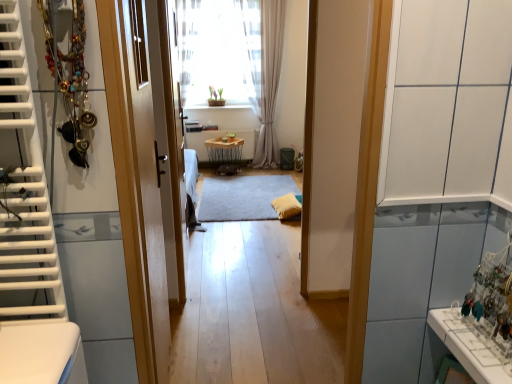
You are a GUI agent. You are given a task and a screenshot of the screen. Output one action in this format:
    pyautogui.click(x=<x>, y=<y>)
    Task: Click on the white sheer curtain at upper center, which ranks as the 1th curtain in left-to-right order
    Image resolution: width=512 pixels, height=384 pixels.
    Given the screenshot: What is the action you would take?
    pyautogui.click(x=187, y=44)

Measure the distance between transparent plastic screen door at center and camera.

transparent plastic screen door at center is 2.34 meters away from camera.

What is the approximate width of white glossy radiator at center?

white glossy radiator at center is 3.10 inches in width.

The width and height of the screenshot is (512, 384). Describe the element at coordinates (218, 137) in the screenshot. I see `white glossy radiator at center` at that location.

What do you see at coordinates (243, 197) in the screenshot?
I see `gray soft rug at center` at bounding box center [243, 197].

This screenshot has width=512, height=384. What are the coordinates of `shiny metallic necklace at left` in the screenshot? It's located at (x=70, y=77).

Where is `light beige sheer curtain at center, the 1th curtain viewed from the right`? light beige sheer curtain at center, the 1th curtain viewed from the right is located at coordinates (269, 80).

Is transparent plastic screen door at center situated inside shiny metallic necklace at left or outside?

transparent plastic screen door at center cannot be found inside shiny metallic necklace at left.

From a real-world perspective, is transparent plastic screen door at center physically located above or below shiny metallic necklace at left?

From a real-world perspective, transparent plastic screen door at center is physically below shiny metallic necklace at left.

Which of these two, transparent plastic screen door at center or shiny metallic necklace at left, is smaller?

Smaller between the two is shiny metallic necklace at left.

Based on the photo, is white sheer curtain at upper center, which ranks as the 1th curtain in left-to-right order, taller than white glossy radiator at center?

Indeed, white sheer curtain at upper center, which ranks as the 1th curtain in left-to-right order, has a greater height compared to white glossy radiator at center.

Which is behind, point (188, 32) or point (222, 132)?

The point (188, 32) is behind.

From the picture: Is white sheer curtain at upper center, which ranks as the 1th curtain in left-to-right order, wider than white glossy radiator at center?

Indeed, white sheer curtain at upper center, which ranks as the 1th curtain in left-to-right order, has a greater width compared to white glossy radiator at center.

Visually, is white sheer curtain at upper center, which ranks as the 1th curtain in left-to-right order, positioned to the left or to the right of white glossy radiator at center?

white sheer curtain at upper center, which ranks as the 1th curtain in left-to-right order, is positioned on white glossy radiator at center's left side.

From the image's perspective, who appears lower, shiny metallic necklace at left or white sheer curtain at upper center, which ranks as the 1th curtain in left-to-right order?

From the image's view, shiny metallic necklace at left is below.

Does shiny metallic necklace at left appear on the right side of white sheer curtain at upper center, which ranks as the 2th curtain in right-to-left order?

Indeed, shiny metallic necklace at left is positioned on the right side of white sheer curtain at upper center, which ranks as the 2th curtain in right-to-left order.

Is shiny metallic necklace at left inside or outside of white sheer curtain at upper center, which ranks as the 1th curtain in left-to-right order?

shiny metallic necklace at left is located beyond the bounds of white sheer curtain at upper center, which ranks as the 1th curtain in left-to-right order.

Between point (211, 147) and point (267, 114), which one is positioned behind?

Point (211, 147)

Can you confirm if wooden table at center is positioned to the right of light beige sheer curtain at center, the second curtain from the left?

No.

Is wooden table at center not inside light beige sheer curtain at center, the second curtain from the left?

wooden table at center lies outside light beige sheer curtain at center, the second curtain from the left,'s area.

Could you measure the distance between wooden table at center and light beige sheer curtain at center, the second curtain from the left?

A distance of 28.29 inches exists between wooden table at center and light beige sheer curtain at center, the second curtain from the left.

From the image's perspective, is white sheer curtain at upper center, which ranks as the 1th curtain in left-to-right order, on transparent plastic screen door at center?

Yes.

From the picture: Between white sheer curtain at upper center, which ranks as the 1th curtain in left-to-right order, and transparent plastic screen door at center, which one is positioned behind?

white sheer curtain at upper center, which ranks as the 1th curtain in left-to-right order, is further away from the camera.

Does white sheer curtain at upper center, which ranks as the 2th curtain in right-to-left order, have a lesser height compared to transparent plastic screen door at center?

Correct, white sheer curtain at upper center, which ranks as the 2th curtain in right-to-left order, is not as tall as transparent plastic screen door at center.

From the image's perspective, is light beige sheer curtain at center, the second curtain from the left, located above or below white glossy radiator at center?

light beige sheer curtain at center, the second curtain from the left, is above white glossy radiator at center.

Between light beige sheer curtain at center, the 1th curtain viewed from the right, and white glossy radiator at center, which one is positioned in front?

light beige sheer curtain at center, the 1th curtain viewed from the right, is more forward.

Does point (279, 27) come in front of point (209, 136)?

That is True.

Is light beige sheer curtain at center, the 1th curtain viewed from the right, oriented towards white glossy radiator at center?

No, light beige sheer curtain at center, the 1th curtain viewed from the right, is not turned towards white glossy radiator at center.

Image resolution: width=512 pixels, height=384 pixels. Identify the location of curtain below the white sheer curtain at upper center, which ranks as the 1th curtain in left-to-right order (from a real-world perspective). (269, 80).

How different are the orientations of white sheer curtain at upper center, which ranks as the 1th curtain in left-to-right order, and light beige sheer curtain at center, the second curtain from the left, in degrees?

0.000129 degrees.

Considering the relative sizes of white sheer curtain at upper center, which ranks as the 1th curtain in left-to-right order, and light beige sheer curtain at center, the second curtain from the left, in the image provided, is white sheer curtain at upper center, which ranks as the 1th curtain in left-to-right order, smaller than light beige sheer curtain at center, the second curtain from the left,?

Indeed, white sheer curtain at upper center, which ranks as the 1th curtain in left-to-right order, has a smaller size compared to light beige sheer curtain at center, the second curtain from the left.

Does point (194, 51) come in front of point (260, 93)?

No, it is not.

This screenshot has height=384, width=512. I want to click on necklace on the right of transparent plastic screen door at center, so click(70, 77).

Find the location of a particular element. The image size is (512, 384). the 2nd curtain positioned above the white glossy radiator at center (from a real-world perspective) is located at coordinates (187, 44).

Considering their positions, is white glossy radiator at center positioned closer to wooden table at center than transparent plastic screen door at center?

→ white glossy radiator at center lies closer to wooden table at center than the other object.

When comparing their distances from wooden door at center, does white sheer curtain at upper center, which ranks as the 1th curtain in left-to-right order, or wooden table at center seem further?

white sheer curtain at upper center, which ranks as the 1th curtain in left-to-right order, lies further to wooden door at center than the other object.

Considering their positions, is wooden table at center positioned further to shiny metallic necklace at left than white glossy radiator at center?

The object further to shiny metallic necklace at left is wooden table at center.

Which object lies nearer to the anchor point white sheer curtain at upper center, which ranks as the 1th curtain in left-to-right order, wooden door at center or transparent plastic screen door at center?

transparent plastic screen door at center.

Based on their spatial positions, is white glossy radiator at center or shiny metallic necklace at left closer to wooden door at center?

shiny metallic necklace at left lies closer to wooden door at center than the other object.

Based on their spatial positions, is light beige sheer curtain at center, the second curtain from the left, or transparent plastic screen door at center further from white sheer curtain at upper center, which ranks as the 1th curtain in left-to-right order?

transparent plastic screen door at center is further to white sheer curtain at upper center, which ranks as the 1th curtain in left-to-right order.

Which object lies nearer to the anchor point wooden door at center, transparent plastic screen door at center or light beige sheer curtain at center, the 1th curtain viewed from the right?

transparent plastic screen door at center is closer to wooden door at center.

Considering their positions, is wooden table at center positioned further to white sheer curtain at upper center, which ranks as the 1th curtain in left-to-right order, than gray soft rug at center?

gray soft rug at center is positioned further to the anchor white sheer curtain at upper center, which ranks as the 1th curtain in left-to-right order.

Locate an element on the screen. mat between transparent plastic screen door at center and white sheer curtain at upper center, which ranks as the 2th curtain in right-to-left order, in the front-back direction is located at coordinates (243, 197).

The width and height of the screenshot is (512, 384). Identify the location of mat between wooden door at center and light beige sheer curtain at center, the 1th curtain viewed from the right, from front to back. (243, 197).

Image resolution: width=512 pixels, height=384 pixels. Find the location of `screen door positioned between shiny metallic necklace at left and gray soft rug at center from near to far`. screen door positioned between shiny metallic necklace at left and gray soft rug at center from near to far is located at coordinates (172, 146).

This screenshot has width=512, height=384. What are the coordinates of `table positioned between transparent plastic screen door at center and white glossy radiator at center from near to far` in the screenshot? It's located at (225, 154).